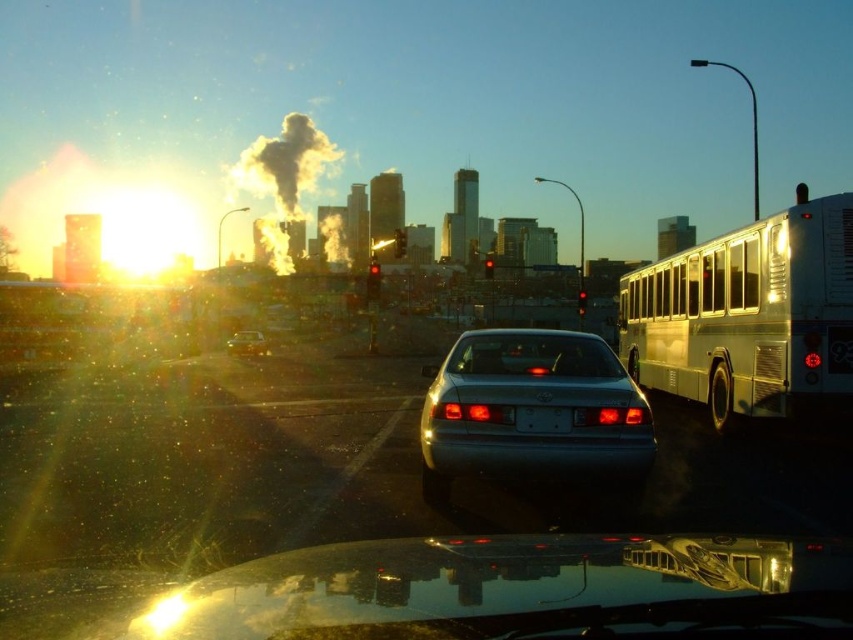
Which is below, transparent glass windshield at center or metallic silver sedan at center?

metallic silver sedan at center is below.

Who is more forward, (x=566, y=358) or (x=258, y=346)?

Positioned in front is point (x=566, y=358).

The width and height of the screenshot is (853, 640). I want to click on transparent glass windshield at center, so click(x=532, y=355).

Is transparent glass windshield at center positioned in front of white plastic license plate at center?

No, transparent glass windshield at center is further to the viewer.

Between point (486, 349) and point (543, 417), which one is positioned in front?

Positioned in front is point (543, 417).

Between point (465, 337) and point (554, 420), which one is positioned in front?

Point (554, 420)

Locate an element on the screen. This screenshot has height=640, width=853. transparent glass windshield at center is located at coordinates (532, 355).

Is point (532, 413) in front of point (254, 344)?

Yes.

Who is taller, white plastic license plate at center or metallic silver sedan at center?

metallic silver sedan at center is taller.

Between point (523, 406) and point (264, 348), which one is positioned in front?

Point (523, 406) is in front.

Locate an element on the screen. The image size is (853, 640). white plastic license plate at center is located at coordinates (543, 419).